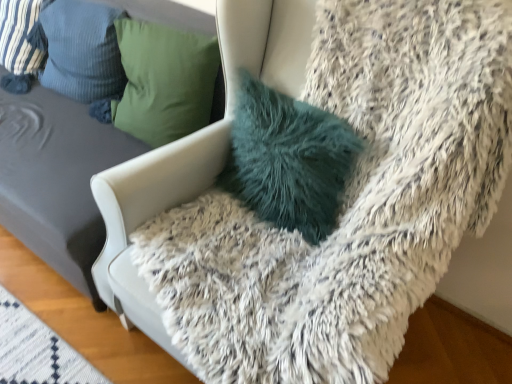
Question: Can you confirm if teal fuzzy pillow at center, the 3th pillow viewed from the left, is wider than striped fabric pillow at upper left, which is counted as the third pillow, starting from the right?

Choices:
 (A) yes
 (B) no

Answer: (B)

Question: Is teal fuzzy pillow at center, which ranks as the 1th pillow in right-to-left order, aimed at striped fabric pillow at upper left, which ranks as the first pillow in left-to-right order?

Choices:
 (A) yes
 (B) no

Answer: (B)

Question: From a real-world perspective, does teal fuzzy pillow at center, which ranks as the 1th pillow in right-to-left order, stand above striped fabric pillow at upper left, which is counted as the third pillow, starting from the right?

Choices:
 (A) yes
 (B) no

Answer: (B)

Question: Is teal fuzzy pillow at center, which ranks as the 1th pillow in right-to-left order, next to striped fabric pillow at upper left, which ranks as the first pillow in left-to-right order?

Choices:
 (A) yes
 (B) no

Answer: (B)

Question: Is teal fuzzy pillow at center, the 3th pillow viewed from the left, facing away from striped fabric pillow at upper left, which ranks as the first pillow in left-to-right order?

Choices:
 (A) no
 (B) yes

Answer: (A)

Question: Visually, is striped fabric pillow at upper left, which is counted as the third pillow, starting from the right, positioned to the left or to the right of striped fabric pillow at upper left, which is the second pillow in right-to-left order?

Choices:
 (A) right
 (B) left

Answer: (B)

Question: Is striped fabric pillow at upper left, which is counted as the third pillow, starting from the right, bigger or smaller than striped fabric pillow at upper left, which is the second pillow in right-to-left order?

Choices:
 (A) big
 (B) small

Answer: (A)

Question: Is point (16, 3) closer or farther from the camera than point (106, 46)?

Choices:
 (A) closer
 (B) farther

Answer: (B)

Question: Considering the positions of striped fabric pillow at upper left, which ranks as the first pillow in left-to-right order, and striped fabric pillow at upper left, arranged as the second pillow when viewed from the left, in the image, is striped fabric pillow at upper left, which ranks as the first pillow in left-to-right order, wider or thinner than striped fabric pillow at upper left, arranged as the second pillow when viewed from the left,?

Choices:
 (A) thin
 (B) wide

Answer: (B)

Question: From the image's perspective, is teal fuzzy pillow at center, which ranks as the 1th pillow in right-to-left order, positioned above or below striped fabric pillow at upper left, arranged as the second pillow when viewed from the left?

Choices:
 (A) above
 (B) below

Answer: (B)

Question: Considering the positions of teal fuzzy pillow at center, which ranks as the 1th pillow in right-to-left order, and striped fabric pillow at upper left, arranged as the second pillow when viewed from the left, in the image, is teal fuzzy pillow at center, which ranks as the 1th pillow in right-to-left order, taller or shorter than striped fabric pillow at upper left, arranged as the second pillow when viewed from the left,?

Choices:
 (A) short
 (B) tall

Answer: (A)

Question: From a real-world perspective, is teal fuzzy pillow at center, which ranks as the 1th pillow in right-to-left order, physically located above or below striped fabric pillow at upper left, arranged as the second pillow when viewed from the left?

Choices:
 (A) above
 (B) below

Answer: (B)

Question: Based on their sizes in the image, would you say teal fuzzy pillow at center, the 3th pillow viewed from the left, is bigger or smaller than striped fabric pillow at upper left, which is the second pillow in right-to-left order?

Choices:
 (A) small
 (B) big

Answer: (A)

Question: From a real-world perspective, relative to fuzzy white chair at upper right, is striped fabric pillow at upper left, which is counted as the third pillow, starting from the right, vertically above or below?

Choices:
 (A) below
 (B) above

Answer: (B)

Question: From their relative heights in the image, would you say striped fabric pillow at upper left, which ranks as the first pillow in left-to-right order, is taller or shorter than fuzzy white chair at upper right?

Choices:
 (A) tall
 (B) short

Answer: (B)